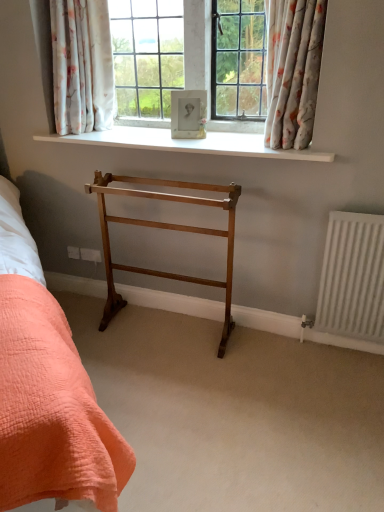
Question: Can you confirm if white matte radiator at right is positioned to the right of porcelain frame at center?

Choices:
 (A) yes
 (B) no

Answer: (A)

Question: Considering the relative sizes of white matte radiator at right and porcelain frame at center in the image provided, is white matte radiator at right thinner than porcelain frame at center?

Choices:
 (A) no
 (B) yes

Answer: (A)

Question: Is the depth of white matte radiator at right greater than that of porcelain frame at center?

Choices:
 (A) no
 (B) yes

Answer: (A)

Question: Is white matte radiator at right at the left side of porcelain frame at center?

Choices:
 (A) no
 (B) yes

Answer: (A)

Question: Is white matte radiator at right shorter than porcelain frame at center?

Choices:
 (A) no
 (B) yes

Answer: (A)

Question: Is white matte radiator at right turned away from porcelain frame at center?

Choices:
 (A) yes
 (B) no

Answer: (B)

Question: From a real-world perspective, is white smooth window sill at upper center physically above porcelain frame at center?

Choices:
 (A) yes
 (B) no

Answer: (B)

Question: Can you confirm if white smooth window sill at upper center is positioned to the right of porcelain frame at center?

Choices:
 (A) yes
 (B) no

Answer: (B)

Question: From a real-world perspective, does white smooth window sill at upper center sit lower than porcelain frame at center?

Choices:
 (A) no
 (B) yes

Answer: (B)

Question: From the image's perspective, is white smooth window sill at upper center located beneath porcelain frame at center?

Choices:
 (A) no
 (B) yes

Answer: (B)

Question: Considering the relative sizes of white smooth window sill at upper center and porcelain frame at center in the image provided, is white smooth window sill at upper center wider than porcelain frame at center?

Choices:
 (A) yes
 (B) no

Answer: (A)

Question: Does white smooth window sill at upper center turn towards porcelain frame at center?

Choices:
 (A) yes
 (B) no

Answer: (A)

Question: Can you confirm if porcelain frame at center is bigger than floral fabric curtain at upper right, which is the 1th curtain from right to left?

Choices:
 (A) yes
 (B) no

Answer: (B)